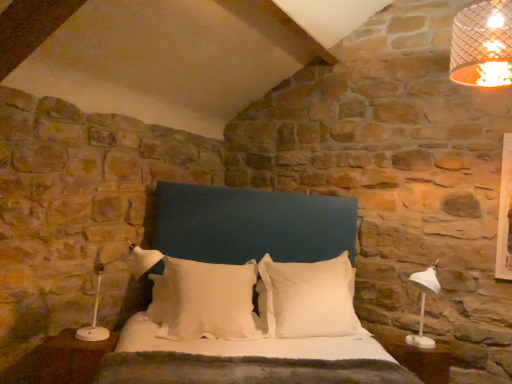
Question: Can you see white soft pillow at center, positioned as the second pillow in right-to-left order, touching white soft pillow at center, marked as the 1th pillow in a right-to-left arrangement?

Choices:
 (A) yes
 (B) no

Answer: (B)

Question: Can you confirm if white soft pillow at center, which ranks as the first pillow in left-to-right order, is smaller than white soft pillow at center, the 2th pillow positioned from the left?

Choices:
 (A) no
 (B) yes

Answer: (B)

Question: Is white soft pillow at center, which ranks as the first pillow in left-to-right order, located outside white soft pillow at center, the 2th pillow positioned from the left?

Choices:
 (A) no
 (B) yes

Answer: (B)

Question: Is white soft pillow at center, positioned as the second pillow in right-to-left order, wider than white soft pillow at center, the 2th pillow positioned from the left?

Choices:
 (A) no
 (B) yes

Answer: (B)

Question: Is white soft pillow at center, which ranks as the first pillow in left-to-right order, far away from white soft pillow at center, the 2th pillow positioned from the left?

Choices:
 (A) yes
 (B) no

Answer: (B)

Question: Is white plastic side table at lower right wider or thinner than white soft pillow at center, the 2th pillow positioned from the left?

Choices:
 (A) thin
 (B) wide

Answer: (A)

Question: From the image's perspective, is white plastic side table at lower right positioned above or below white soft pillow at center, marked as the 1th pillow in a right-to-left arrangement?

Choices:
 (A) below
 (B) above

Answer: (A)

Question: Considering the relative positions of white plastic side table at lower right and white soft pillow at center, the 2th pillow positioned from the left, in the image provided, is white plastic side table at lower right to the left or to the right of white soft pillow at center, the 2th pillow positioned from the left,?

Choices:
 (A) right
 (B) left

Answer: (A)

Question: Is point (444, 370) positioned closer to the camera than point (291, 278)?

Choices:
 (A) farther
 (B) closer

Answer: (B)

Question: Is point (94, 327) closer or farther from the camera than point (228, 334)?

Choices:
 (A) farther
 (B) closer

Answer: (B)

Question: In terms of width, does white plastic lamp at left look wider or thinner when compared to white soft pillow at center, positioned as the second pillow in right-to-left order?

Choices:
 (A) wide
 (B) thin

Answer: (A)

Question: Is white plastic lamp at left in front of or behind white soft pillow at center, positioned as the second pillow in right-to-left order, in the image?

Choices:
 (A) behind
 (B) front

Answer: (B)

Question: Based on their sizes in the image, would you say white plastic lamp at left is bigger or smaller than white soft pillow at center, which ranks as the first pillow in left-to-right order?

Choices:
 (A) small
 (B) big

Answer: (A)

Question: Is white plastic lamp at left bigger or smaller than brown wood nightstand at lower left?

Choices:
 (A) big
 (B) small

Answer: (A)

Question: Considering the positions of white plastic lamp at left and brown wood nightstand at lower left in the image, is white plastic lamp at left wider or thinner than brown wood nightstand at lower left?

Choices:
 (A) thin
 (B) wide

Answer: (B)